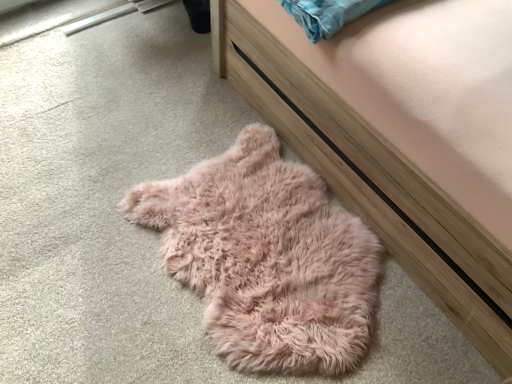
Question: In terms of size, does fuzzy pink rug at lower left appear bigger or smaller than fuzzy pink rug at lower left?

Choices:
 (A) small
 (B) big

Answer: (B)

Question: From the image's perspective, is fuzzy pink rug at lower left above or below fuzzy pink rug at lower left?

Choices:
 (A) below
 (B) above

Answer: (B)

Question: In terms of width, does fuzzy pink rug at lower left look wider or thinner when compared to fuzzy pink rug at lower left?

Choices:
 (A) thin
 (B) wide

Answer: (B)

Question: Is fuzzy pink rug at lower left inside the boundaries of fuzzy pink rug at lower left, or outside?

Choices:
 (A) outside
 (B) inside

Answer: (A)

Question: Based on their positions, is fuzzy pink rug at lower left located to the left or right of fuzzy pink rug at lower left?

Choices:
 (A) right
 (B) left

Answer: (B)

Question: Is fuzzy pink rug at lower left taller or shorter than fuzzy pink rug at lower left?

Choices:
 (A) short
 (B) tall

Answer: (A)

Question: From the image's perspective, relative to fuzzy pink rug at lower left, is fuzzy pink rug at lower left above or below?

Choices:
 (A) above
 (B) below

Answer: (B)